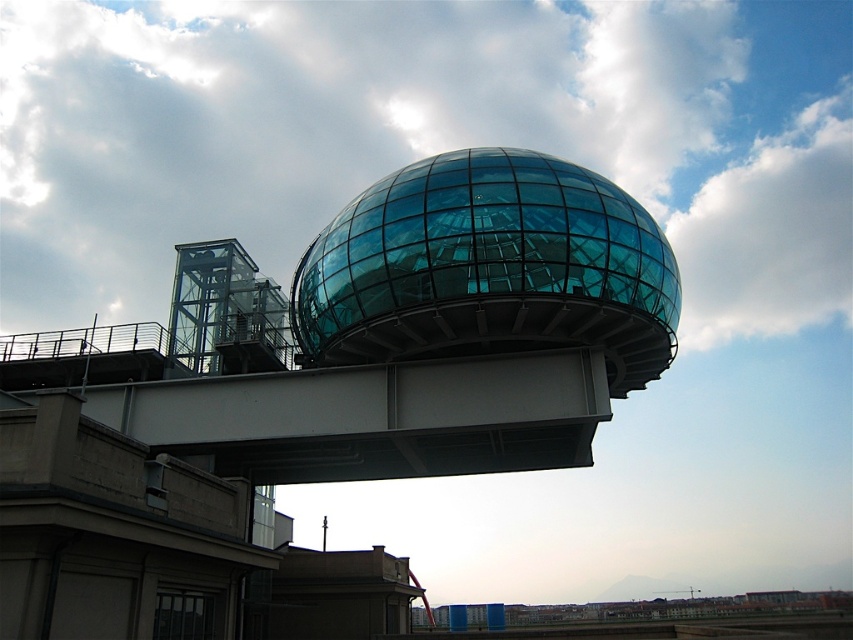
You are an architect designing a new observation deck for the transparent glass sphere at center. The deck must be attached to the white metallic overpass at center. What is the minimum distance you need to account for between the two structures to ensure proper installation?

The minimum distance to account for between the transparent glass sphere at center and the white metallic overpass at center is 15.85 feet.

You are standing at the base of the modern building and want to reach the transparent glass sphere at center. If the elevator can only travel vertically and the sphere is 102.74 feet away from you, how far vertically must you ascend?

The transparent glass sphere at center is 102.74 feet away from the viewer, so you must ascend 102.74 feet vertically to reach it.

Consider the image. You are standing in front of the architectural structure and want to take a photo of the transparent glass sphere at center and the white metallic overpass at center. Which object is closer to you, and will it appear larger in your photo?

The transparent glass sphere at center is closer to you than the white metallic overpass at center, so it will appear larger in the photo.